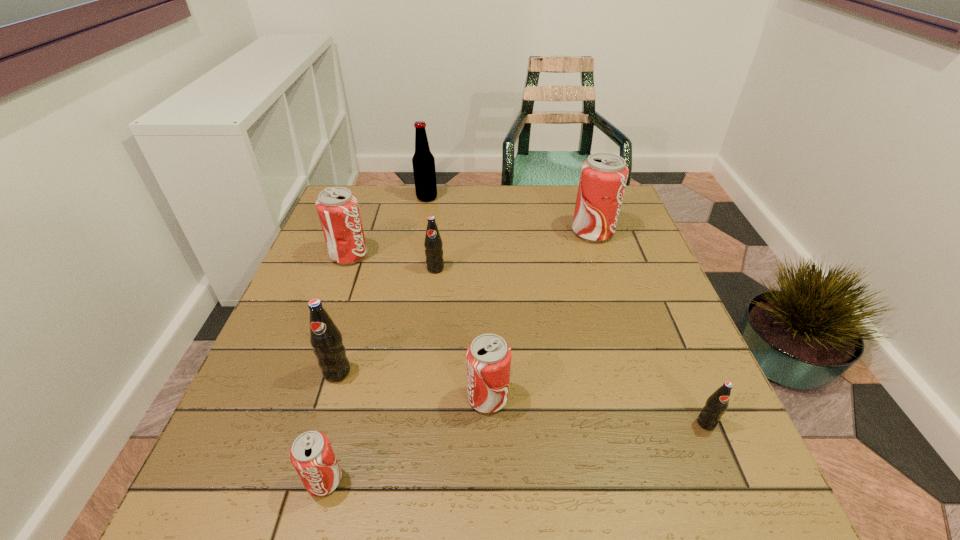
Locate which object ranks fourth in proximity to the second farthest black pop. Please provide its 2D coordinates. Your answer should be formatted as a tuple, i.e. [(x, y)], where the tuple contains the x and y coordinates of a point satisfying the conditions above.

[(337, 208)]

The height and width of the screenshot is (540, 960). I want to click on object that is the fourth nearest to the fourth soda can from left to right, so click(x=488, y=357).

Locate an element on the screen. This screenshot has height=540, width=960. soda can that is the third nearest to the farthest object is located at coordinates (603, 177).

Where is `the closest soda can to the biggest black pop`? the closest soda can to the biggest black pop is located at coordinates (311, 454).

The width and height of the screenshot is (960, 540). I want to click on the closest pink soda can to the second pink soda can from left to right, so click(x=488, y=357).

Identify which pink soda can is the second closest to the leftmost pink soda can. Please provide its 2D coordinates. Your answer should be formatted as a tuple, i.e. [(x, y)], where the tuple contains the x and y coordinates of a point satisfying the conditions above.

[(311, 454)]

Identify which black pop is the nearest to the second black pop from left to right. Please provide its 2D coordinates. Your answer should be formatted as a tuple, i.e. [(x, y)], where the tuple contains the x and y coordinates of a point satisfying the conditions above.

[(325, 338)]

Where is `black pop that is the second closest one to the sixth object from left to right`? This screenshot has height=540, width=960. black pop that is the second closest one to the sixth object from left to right is located at coordinates (433, 244).

Where is `vacant area in the image that satisfies the following two spatial constraints: 1. on the front label of the biggest black pop; 2. on the right side of the second nearest pink soda can`? The height and width of the screenshot is (540, 960). vacant area in the image that satisfies the following two spatial constraints: 1. on the front label of the biggest black pop; 2. on the right side of the second nearest pink soda can is located at coordinates (329, 398).

What are the coordinates of `vacant point that satisfies the following two spatial constraints: 1. on the front label of the third pink soda can from left to right; 2. on the right side of the fourth soda can from left to right` in the screenshot? It's located at (420, 398).